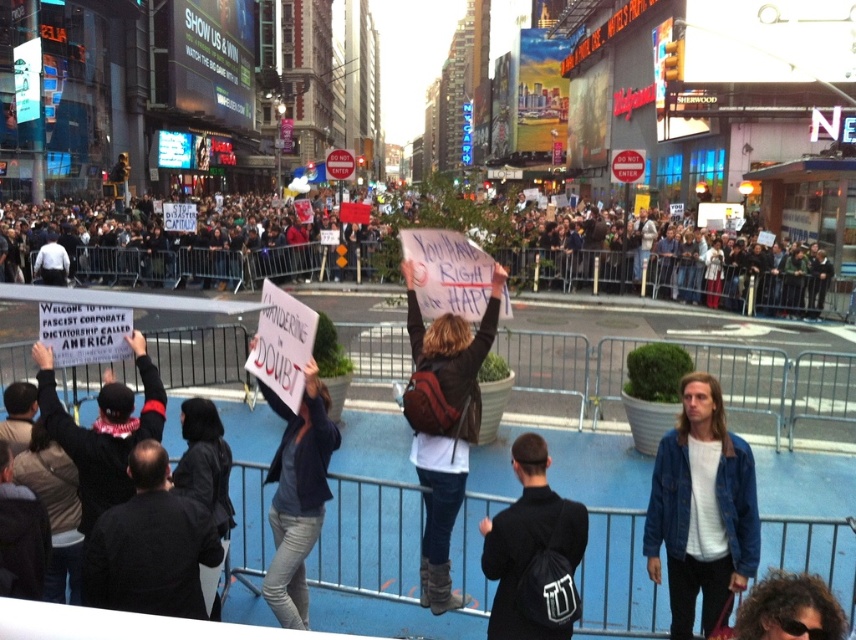
Is point (809, 273) positioned behind point (532, 531)?

Yes, point (809, 273) is farther from viewer.

What do you see at coordinates (218, 259) in the screenshot?
I see `dark gray concrete crowd at upper center` at bounding box center [218, 259].

This screenshot has width=856, height=640. Identify the location of dark gray concrete crowd at upper center. (218, 259).

This screenshot has height=640, width=856. Find the location of `dark gray concrete crowd at upper center`. dark gray concrete crowd at upper center is located at coordinates (218, 259).

This screenshot has height=640, width=856. Identify the location of dark gray concrete crowd at upper center. (218, 259).

Is dark gray jacket at lower left thinner than black scarf at left?

Yes, dark gray jacket at lower left is thinner than black scarf at left.

Describe the element at coordinates (150, 545) in the screenshot. The width and height of the screenshot is (856, 640). I see `dark gray jacket at lower left` at that location.

Which is behind, point (140, 461) or point (140, 369)?

The point (140, 369) is behind.

Where is `dark gray jacket at lower left`? This screenshot has width=856, height=640. dark gray jacket at lower left is located at coordinates (150, 545).